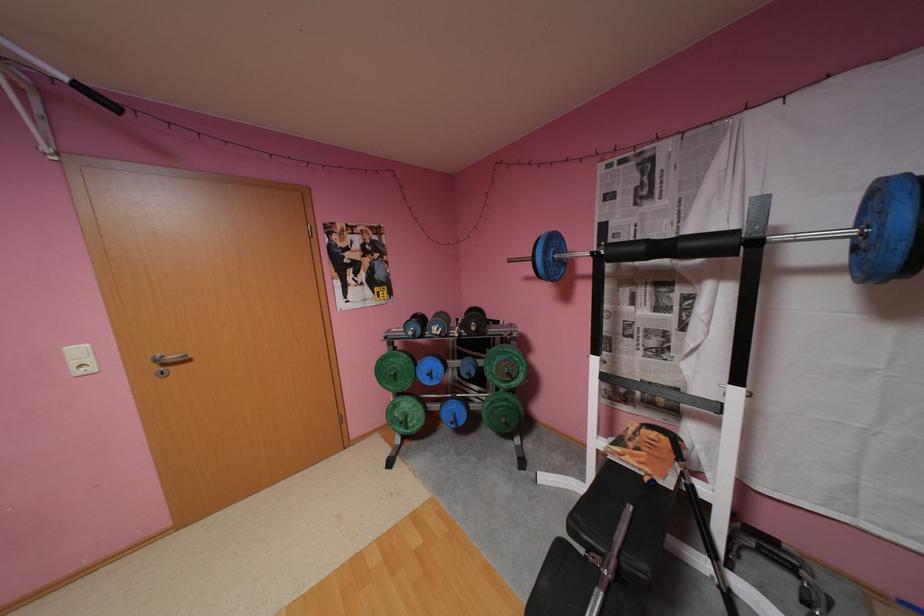
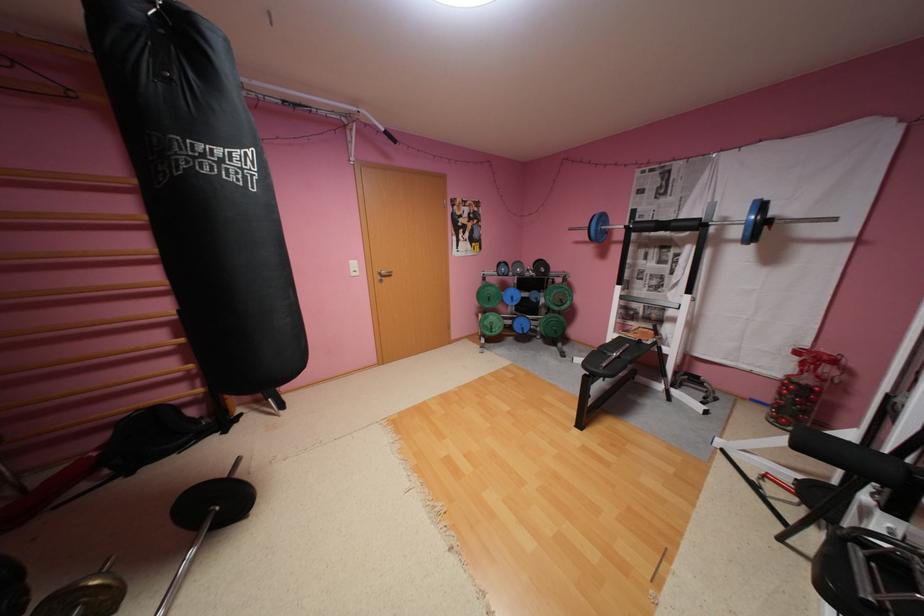
Which direction would the cameraman need to move to produce the second image?

The cameraman moved toward left, backward.